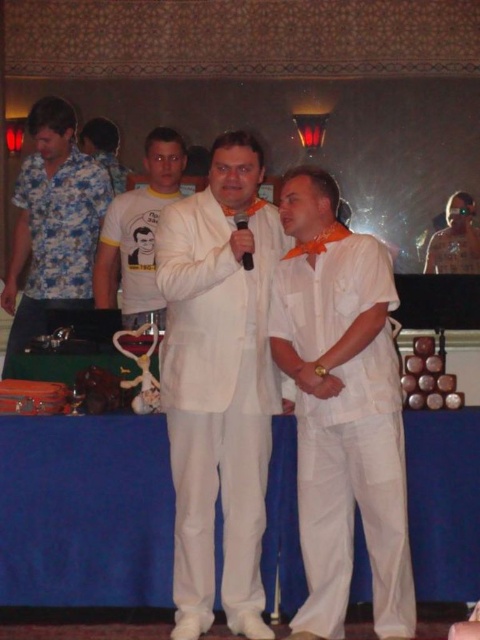
Does white cotton t-shirt at center come behind orange fabric tie at center?

No.

Is point (141, 296) positioned before point (463, 224)?

Yes, point (141, 296) is in front of point (463, 224).

Image resolution: width=480 pixels, height=640 pixels. What do you see at coordinates (139, 232) in the screenshot? I see `white cotton t-shirt at center` at bounding box center [139, 232].

Identify the location of white cotton t-shirt at center. The height and width of the screenshot is (640, 480). (139, 232).

Does floral fabric shirt at left have a greater height compared to black plastic microphone at center?

Correct, floral fabric shirt at left is much taller as black plastic microphone at center.

Is point (36, 160) farther from camera compared to point (241, 256)?

Yes, point (36, 160) is behind point (241, 256).

The width and height of the screenshot is (480, 640). I want to click on floral fabric shirt at left, so click(x=54, y=221).

Who is more forward, (28, 253) or (119, 230)?

Positioned in front is point (119, 230).

Can you confirm if floral fabric shirt at left is positioned above white cotton t-shirt at center?

Yes, floral fabric shirt at left is above white cotton t-shirt at center.

I want to click on floral fabric shirt at left, so click(x=54, y=221).